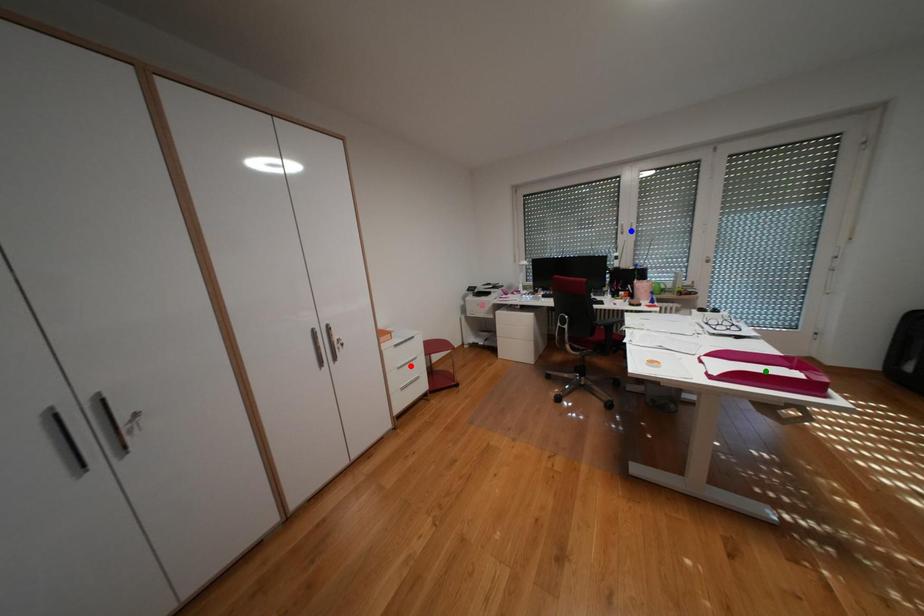
Order these from nearest to farthest:
- red point
- green point
- blue point

1. green point
2. red point
3. blue point